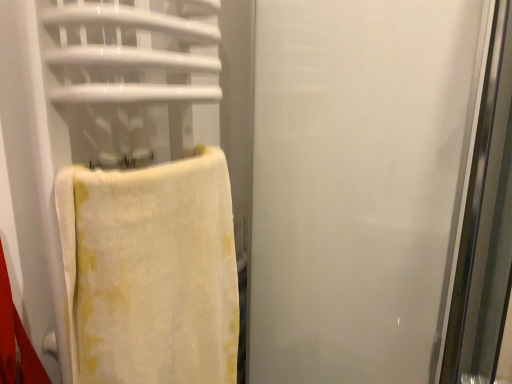
Question: Based on their positions, is yellow textured towel at left located to the left or right of transparent frosted glass screen door at right?

Choices:
 (A) left
 (B) right

Answer: (A)

Question: From a real-world perspective, is yellow textured towel at left physically located above or below transparent frosted glass screen door at right?

Choices:
 (A) above
 (B) below

Answer: (B)

Question: Looking at the image, does yellow textured towel at left seem bigger or smaller compared to transparent frosted glass screen door at right?

Choices:
 (A) big
 (B) small

Answer: (B)

Question: From the image's perspective, relative to yellow textured towel at left, is transparent frosted glass screen door at right above or below?

Choices:
 (A) above
 (B) below

Answer: (A)

Question: Is point (395, 322) closer or farther from the camera than point (173, 347)?

Choices:
 (A) closer
 (B) farther

Answer: (B)

Question: Is transparent frosted glass screen door at right wider or thinner than yellow textured towel at left?

Choices:
 (A) wide
 (B) thin

Answer: (A)

Question: Considering the positions of transparent frosted glass screen door at right and yellow textured towel at left in the image, is transparent frosted glass screen door at right taller or shorter than yellow textured towel at left?

Choices:
 (A) short
 (B) tall

Answer: (B)